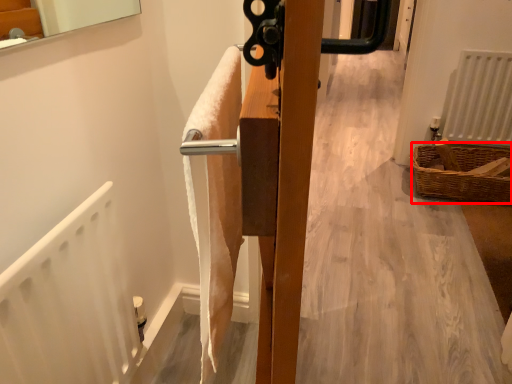
Question: From the image's perspective, considering the relative positions of basket (annotated by the red box) and radiator in the image provided, where is basket (annotated by the red box) located with respect to the staircase?

Choices:
 (A) above
 (B) below

Answer: (B)